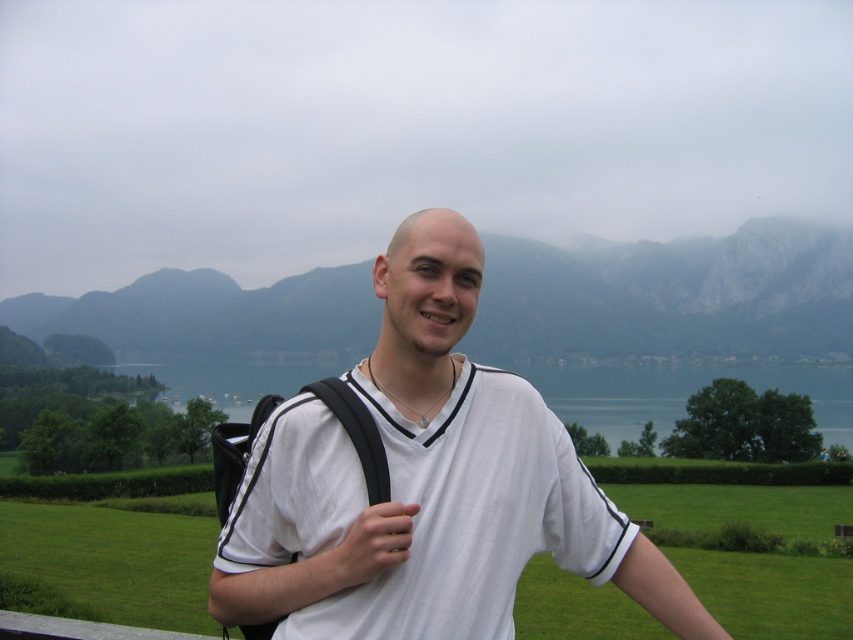
Question: Does green rocky mountain at upper center appear on the right side of green water at center?

Choices:
 (A) no
 (B) yes

Answer: (B)

Question: Which object is positioned farthest from the green rocky mountain at upper center?

Choices:
 (A) green water at center
 (B) white cotton t-shirt at center

Answer: (B)

Question: Considering the relative positions of green rocky mountain at upper center and green water at center in the image provided, where is green rocky mountain at upper center located with respect to green water at center?

Choices:
 (A) left
 (B) right

Answer: (B)

Question: In this image, where is white cotton t-shirt at center located relative to green rocky mountain at upper center?

Choices:
 (A) below
 (B) above

Answer: (A)

Question: Which point appears closest to the camera in this image?

Choices:
 (A) (428, 388)
 (B) (712, 304)

Answer: (A)

Question: Estimate the real-world distances between objects in this image. Which object is closer to the green water at center?

Choices:
 (A) green rocky mountain at upper center
 (B) white cotton t-shirt at center

Answer: (A)